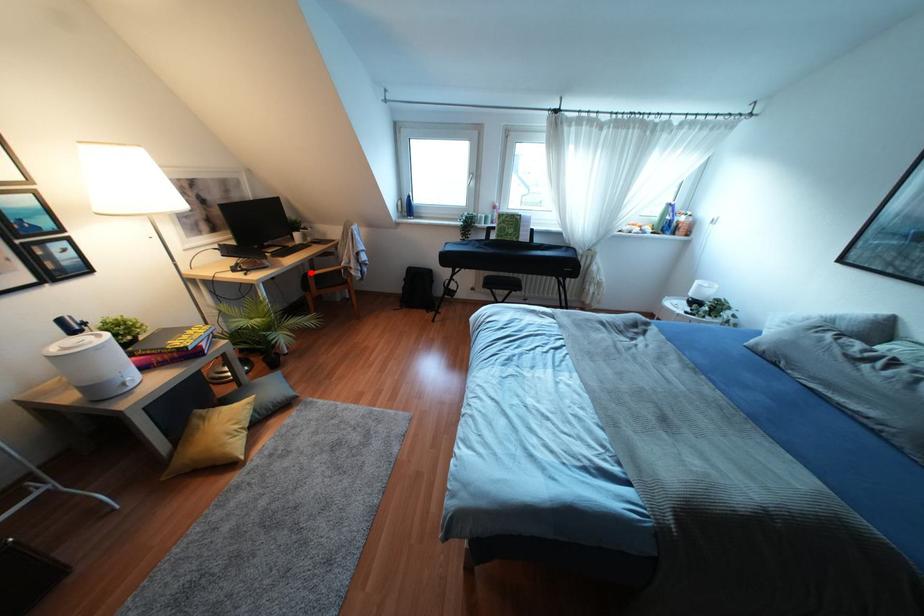
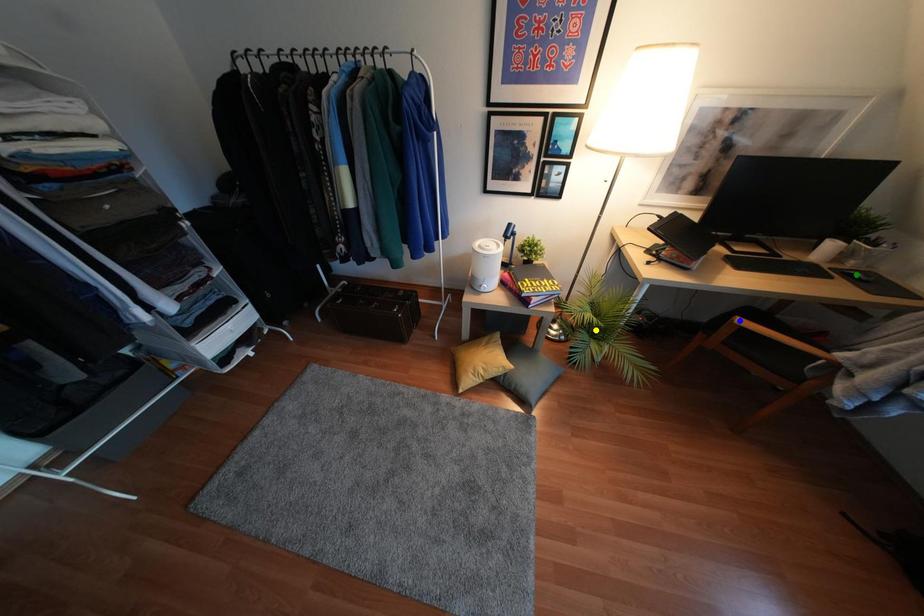
Question: I am providing you with two images of the same scene from different viewpoints. A red point is marked on the first image. You are given multiple points on the second image. Which point in image 2 represents the same 3d spot as the red point in image 1?

Choices:
 (A) green point
 (B) blue point
 (C) yellow point

Answer: (B)